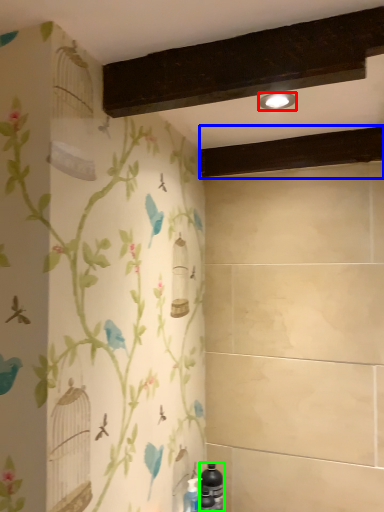
Question: Estimate the real-world distances between objects in this image. Which object is closer to light fixture (highlighted by a red box), plank (highlighted by a blue box) or bottle (highlighted by a green box)?

Choices:
 (A) plank
 (B) bottle

Answer: (A)